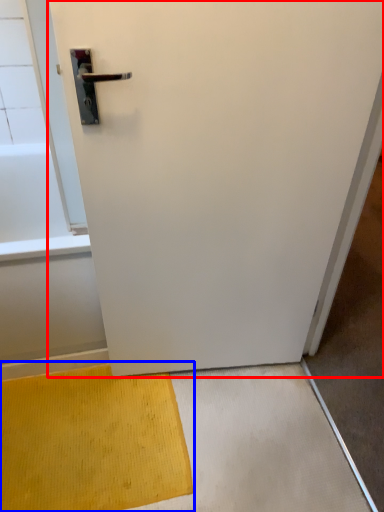
Question: Which object is further to the camera taking this photo, door (highlighted by a red box) or doormat (highlighted by a blue box)?

Choices:
 (A) door
 (B) doormat

Answer: (B)